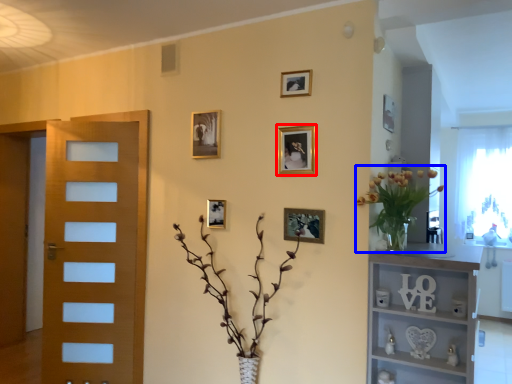
Question: Which point is further to the camera, picture frame (highlighted by a red box) or floral arrangement (highlighted by a blue box)?

Choices:
 (A) picture frame
 (B) floral arrangement

Answer: (A)